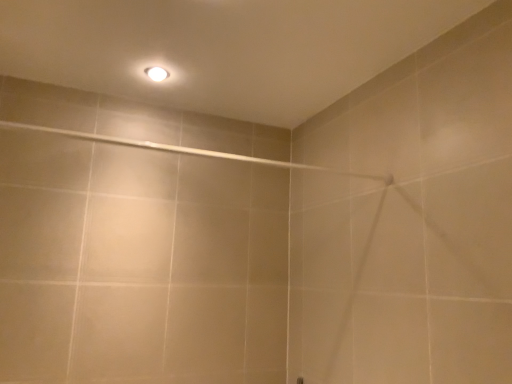
What do you see at coordinates (192, 151) in the screenshot? I see `beige ceramic shower at upper center` at bounding box center [192, 151].

What is the approximate width of beige ceramic shower at upper center?

beige ceramic shower at upper center is 1.48 inches in width.

Find the location of `beige ceramic shower at upper center`. beige ceramic shower at upper center is located at coordinates (192, 151).

At what (x,y) coordinates should I click in order to perform the action: click on white glossy light bulb at upper center. Please return your answer as a coordinate pair (x, y). This screenshot has height=384, width=512. Looking at the image, I should click on (157, 73).

The width and height of the screenshot is (512, 384). What do you see at coordinates (157, 73) in the screenshot?
I see `white glossy light bulb at upper center` at bounding box center [157, 73].

Locate an element on the screen. The width and height of the screenshot is (512, 384). beige ceramic shower at upper center is located at coordinates (192, 151).

Does beige ceramic shower at upper center appear on the right side of white glossy light bulb at upper center?

Yes.

Between beige ceramic shower at upper center and white glossy light bulb at upper center, which one is positioned in front?

beige ceramic shower at upper center is closer to the camera.

Is point (111, 137) closer to camera compared to point (162, 71)?

No, (111, 137) is further to viewer.

From the image's perspective, is beige ceramic shower at upper center located beneath white glossy light bulb at upper center?

Yes.

From a real-world perspective, is beige ceramic shower at upper center located higher than white glossy light bulb at upper center?

No, from a real-world perspective, beige ceramic shower at upper center is not over white glossy light bulb at upper center

Is beige ceramic shower at upper center wider or thinner than white glossy light bulb at upper center?

In the image, beige ceramic shower at upper center appears to be more narrow than white glossy light bulb at upper center.

Can you confirm if beige ceramic shower at upper center is shorter than white glossy light bulb at upper center?

No.

Considering the sizes of objects beige ceramic shower at upper center and white glossy light bulb at upper center in the image provided, who is smaller, beige ceramic shower at upper center or white glossy light bulb at upper center?

white glossy light bulb at upper center.

Is beige ceramic shower at upper center situated inside white glossy light bulb at upper center or outside?

beige ceramic shower at upper center cannot be found inside white glossy light bulb at upper center.

Are beige ceramic shower at upper center and white glossy light bulb at upper center far apart?

Actually, beige ceramic shower at upper center and white glossy light bulb at upper center are a little close together.

Is beige ceramic shower at upper center looking in the opposite direction of white glossy light bulb at upper center?

No, beige ceramic shower at upper center is not facing the opposite direction of white glossy light bulb at upper center.

I want to click on shower in front of the white glossy light bulb at upper center, so click(192, 151).

Can you confirm if white glossy light bulb at upper center is positioned to the right of beige ceramic shower at upper center?

Incorrect, white glossy light bulb at upper center is not on the right side of beige ceramic shower at upper center.

Which is in front, white glossy light bulb at upper center or beige ceramic shower at upper center?

beige ceramic shower at upper center is in front.

Which is behind, point (168, 73) or point (319, 167)?

Point (319, 167)

From the image's perspective, which is above, white glossy light bulb at upper center or beige ceramic shower at upper center?

white glossy light bulb at upper center is shown above in the image.

From a real-world perspective, is white glossy light bulb at upper center over beige ceramic shower at upper center?

Correct, in the physical world, white glossy light bulb at upper center is higher than beige ceramic shower at upper center.

Can you confirm if white glossy light bulb at upper center is wider than beige ceramic shower at upper center?

Yes.

Who is taller, white glossy light bulb at upper center or beige ceramic shower at upper center?

With more height is beige ceramic shower at upper center.

Considering the relative sizes of white glossy light bulb at upper center and beige ceramic shower at upper center in the image provided, is white glossy light bulb at upper center smaller than beige ceramic shower at upper center?

Yes, white glossy light bulb at upper center is smaller than beige ceramic shower at upper center.

Is white glossy light bulb at upper center located outside beige ceramic shower at upper center?

Absolutely, white glossy light bulb at upper center is external to beige ceramic shower at upper center.

Is white glossy light bulb at upper center placed right next to beige ceramic shower at upper center?

No.

Is white glossy light bulb at upper center aimed at beige ceramic shower at upper center?

No.

Measure the distance between white glossy light bulb at upper center and beige ceramic shower at upper center.

A distance of 16.66 inches exists between white glossy light bulb at upper center and beige ceramic shower at upper center.

Locate an element on the screen. This screenshot has height=384, width=512. light bulb behind the beige ceramic shower at upper center is located at coordinates (157, 73).

The height and width of the screenshot is (384, 512). I want to click on shower located on the right of white glossy light bulb at upper center, so pos(192,151).

Locate an element on the screen. This screenshot has height=384, width=512. light bulb located behind the beige ceramic shower at upper center is located at coordinates (157, 73).